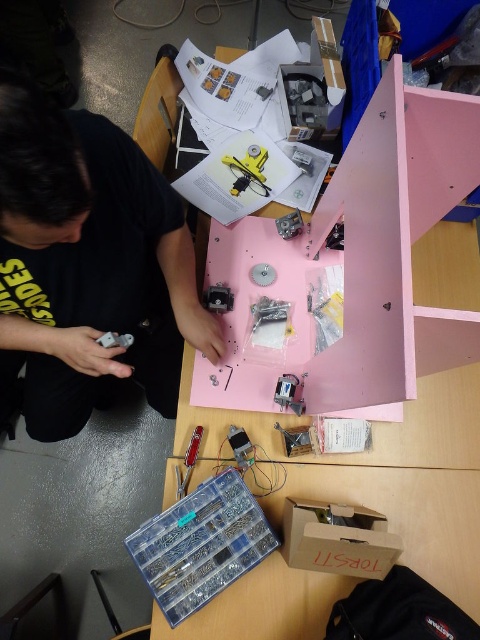
Does point (12, 156) come behind point (239, 189)?

That is False.

Locate an element on the screen. The image size is (480, 640). matte black shirt at upper left is located at coordinates (x=87, y=266).

Image resolution: width=480 pixels, height=640 pixels. In order to click on pink matte table at center in this screenshot , I will do `click(391, 340)`.

Looking at this image, is pink matte table at center smaller than matte black shirt at upper left?

Actually, pink matte table at center might be larger than matte black shirt at upper left.

You are a GUI agent. You are given a task and a screenshot of the screen. Output one action in this format:
    pyautogui.click(x=<x>, y=<y>)
    Task: Click on the pink matte table at center
    
    Given the screenshot: What is the action you would take?
    pyautogui.click(x=391, y=340)

Does cardboard box at lower center have a greater width compared to yellow plastic gear at center?

Indeed, cardboard box at lower center has a greater width compared to yellow plastic gear at center.

Which is in front, point (376, 561) or point (252, 156)?

Point (376, 561)

The width and height of the screenshot is (480, 640). Describe the element at coordinates (337, 540) in the screenshot. I see `cardboard box at lower center` at that location.

Locate an element on the screen. The height and width of the screenshot is (640, 480). cardboard box at lower center is located at coordinates [x=337, y=540].